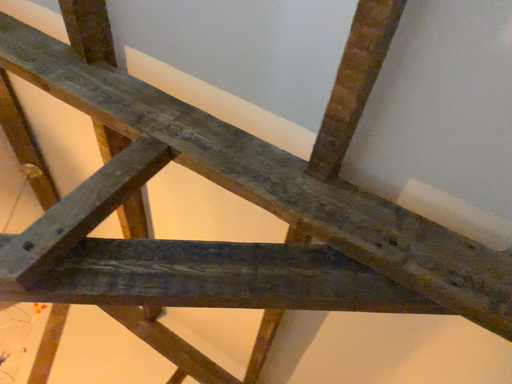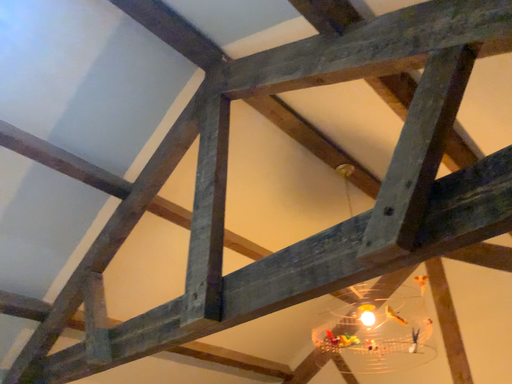
Question: Which way did the camera rotate in the video?

Choices:
 (A) rotated downward
 (B) rotated upward

Answer: (A)